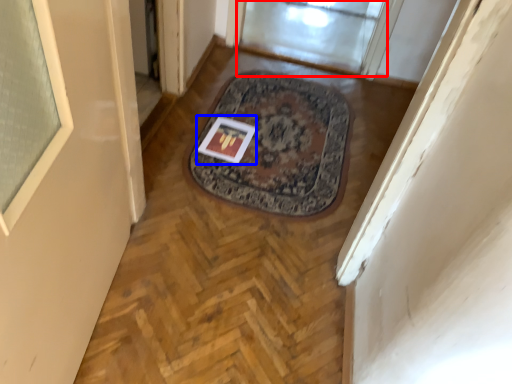
Question: Which of the following is the closest to the observer, window screen (highlighted by a red box) or postcard (highlighted by a blue box)?

Choices:
 (A) window screen
 (B) postcard

Answer: (B)